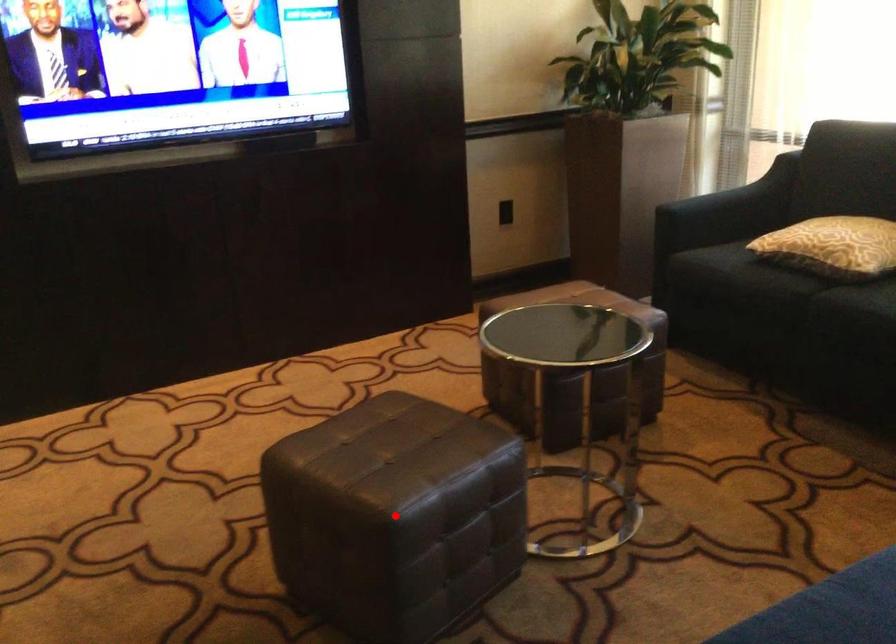
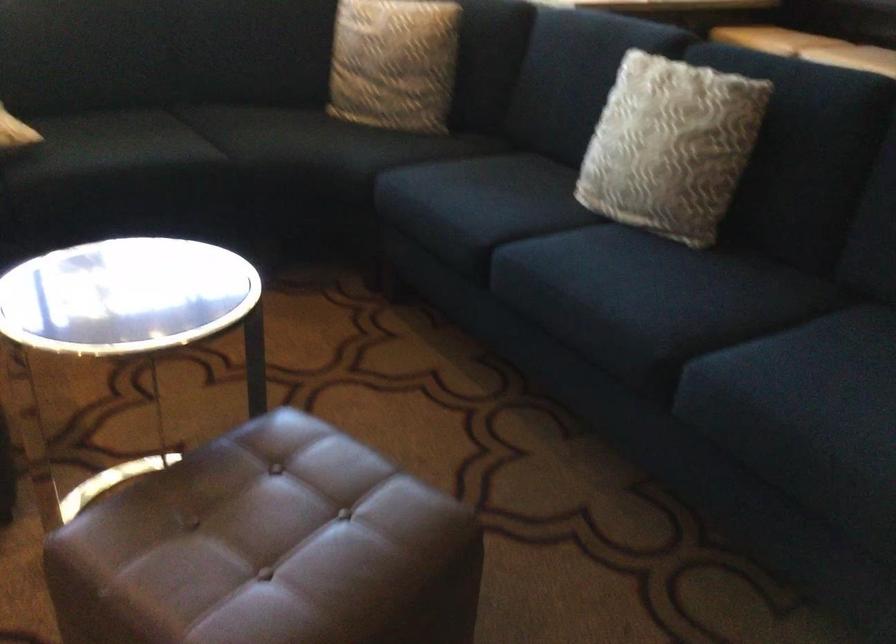
The point at the highlighted location is marked in the first image. Where is the corresponding point in the second image?

(474, 493)